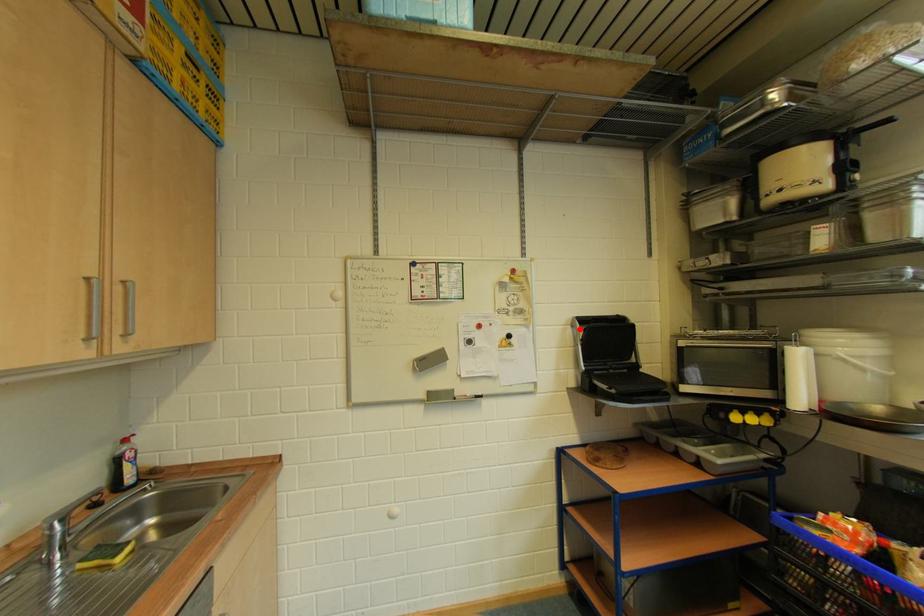
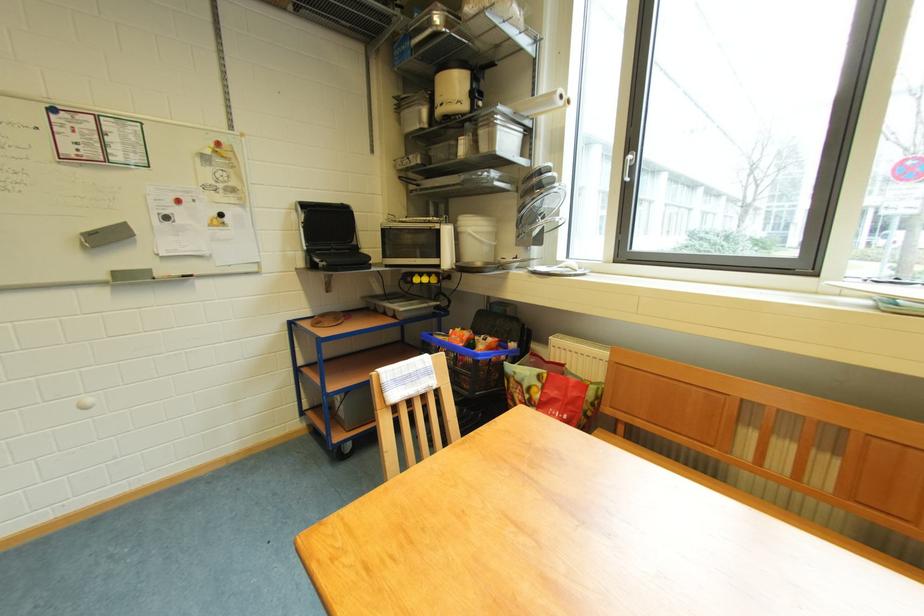
Question: I am providing you with two images of the same scene from different viewpoints. A red point is marked on the first image. At the location where the point appears in image 1, is it still visible in image 2?

Choices:
 (A) Yes
 (B) No

Answer: (A)